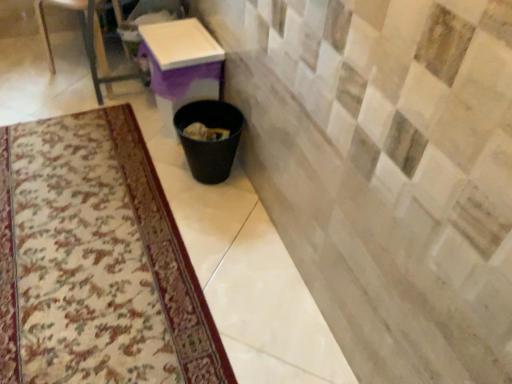
Describe the element at coordinates (96, 261) in the screenshot. I see `carpeted mat at lower left` at that location.

You are a GUI agent. You are given a task and a screenshot of the screen. Output one action in this format:
    pyautogui.click(x=<x>, y=<y>)
    Task: Click on the carpeted mat at lower left
    The image size is (512, 384).
    Given the screenshot: What is the action you would take?
    pyautogui.click(x=96, y=261)

Is carpeted mat at lower left inside black plastic trash can at lower center?

No, carpeted mat at lower left is located outside of black plastic trash can at lower center.

Which is in front, black plastic trash can at lower center or carpeted mat at lower left?

Positioned in front is carpeted mat at lower left.

From a real-world perspective, is black plastic trash can at lower center positioned over carpeted mat at lower left based on gravity?

Yes, from a real-world perspective, black plastic trash can at lower center is on top of carpeted mat at lower left.

Considering the sizes of black plastic trash can at lower center and carpeted mat at lower left in the image, is black plastic trash can at lower center wider or thinner than carpeted mat at lower left?

Clearly, black plastic trash can at lower center has less width compared to carpeted mat at lower left.

Is metallic glass table at upper left wider or thinner than white glossy table at center?

Clearly, metallic glass table at upper left has more width compared to white glossy table at center.

The height and width of the screenshot is (384, 512). I want to click on table in front of the metallic glass table at upper left, so click(181, 65).

Are metallic glass table at upper left and white glossy table at center making contact?

metallic glass table at upper left and white glossy table at center are clearly separated.

Is metallic glass table at upper left shorter than white glossy table at center?

No, metallic glass table at upper left is not shorter than white glossy table at center.

From the image's perspective, between white glossy table at center and metallic glass table at upper left, who is located below?

white glossy table at center, from the image's perspective.

Is white glossy table at center oriented towards metallic glass table at upper left?

No, white glossy table at center is not turned towards metallic glass table at upper left.

Would you say white glossy table at center is a long distance from metallic glass table at upper left?

They are positioned close to each other.

Is white glossy table at center smaller than metallic glass table at upper left?

Yes.

How much distance is there between carpeted mat at lower left and metallic glass table at upper left?

They are 37.00 inches apart.

Between carpeted mat at lower left and metallic glass table at upper left, which one is positioned in front?

carpeted mat at lower left is in front.

Consider the image. Is carpeted mat at lower left shorter than metallic glass table at upper left?

Correct, carpeted mat at lower left is not as tall as metallic glass table at upper left.

Between carpeted mat at lower left and metallic glass table at upper left, which one appears on the right side from the viewer's perspective?

carpeted mat at lower left is more to the right.

From a real-world perspective, which is physically below, black plastic trash can at lower center or white glossy table at center?

From a 3D spatial view, black plastic trash can at lower center is below.

How different are the orientations of black plastic trash can at lower center and white glossy table at center in degrees?

black plastic trash can at lower center and white glossy table at center are facing 0.000851 degrees away from each other.

Can you confirm if black plastic trash can at lower center is thinner than white glossy table at center?

Yes.

Is the position of black plastic trash can at lower center less distant than that of white glossy table at center?

Yes.

Which of these two, carpeted mat at lower left or black plastic trash can at lower center, is smaller?

carpeted mat at lower left.

Based on their positions, is carpeted mat at lower left located to the left or right of black plastic trash can at lower center?

In the image, carpeted mat at lower left appears on the left side of black plastic trash can at lower center.

Considering the sizes of carpeted mat at lower left and black plastic trash can at lower center in the image, is carpeted mat at lower left taller or shorter than black plastic trash can at lower center?

In the image, carpeted mat at lower left appears to be shorter than black plastic trash can at lower center.

From the image's perspective, which is above, carpeted mat at lower left or black plastic trash can at lower center?

black plastic trash can at lower center appears higher in the image.

Is black plastic trash can at lower center surrounded by white glossy table at center?

No, black plastic trash can at lower center is located outside of white glossy table at center.

Is white glossy table at center to the left of black plastic trash can at lower center from the viewer's perspective?

Yes.

From a real-world perspective, which is physically below, white glossy table at center or black plastic trash can at lower center?

black plastic trash can at lower center is physically lower.

This screenshot has height=384, width=512. In order to click on mat that is in front of the black plastic trash can at lower center in this screenshot , I will do `click(96, 261)`.

Locate an element on the screen. The width and height of the screenshot is (512, 384). furniture above the white glossy table at center (from a real-world perspective) is located at coordinates (92, 42).

Based on their spatial positions, is black plastic trash can at lower center or carpeted mat at lower left closer to metallic glass table at upper left?

black plastic trash can at lower center.

Estimate the real-world distances between objects in this image. Which object is further from white glossy table at center, black plastic trash can at lower center or carpeted mat at lower left?

carpeted mat at lower left.

Which object lies further to the anchor point white glossy table at center, black plastic trash can at lower center or metallic glass table at upper left?

Based on the image, metallic glass table at upper left appears to be further to white glossy table at center.

When comparing their distances from metallic glass table at upper left, does black plastic trash can at lower center or white glossy table at center seem further?

black plastic trash can at lower center.

When comparing their distances from black plastic trash can at lower center, does metallic glass table at upper left or carpeted mat at lower left seem further?

metallic glass table at upper left is positioned further to the anchor black plastic trash can at lower center.

Considering their positions, is metallic glass table at upper left positioned further to carpeted mat at lower left than white glossy table at center?

metallic glass table at upper left is further to carpeted mat at lower left.

From the image, which object appears to be nearer to black plastic trash can at lower center, carpeted mat at lower left or white glossy table at center?

Based on the image, white glossy table at center appears to be nearer to black plastic trash can at lower center.

From the image, which object appears to be farther from carpeted mat at lower left, black plastic trash can at lower center or metallic glass table at upper left?

metallic glass table at upper left.

Identify the location of table between metallic glass table at upper left and black plastic trash can at lower center in the horizontal direction. The height and width of the screenshot is (384, 512). (181, 65).

Where is `waste container between metallic glass table at upper left and carpeted mat at lower left in the up-down direction`? The image size is (512, 384). waste container between metallic glass table at upper left and carpeted mat at lower left in the up-down direction is located at coordinates (210, 140).

Image resolution: width=512 pixels, height=384 pixels. What are the coordinates of `table between metallic glass table at upper left and carpeted mat at lower left from top to bottom` in the screenshot? It's located at (181, 65).

Locate an element on the screen. waste container located between carpeted mat at lower left and white glossy table at center in the depth direction is located at coordinates (210, 140).